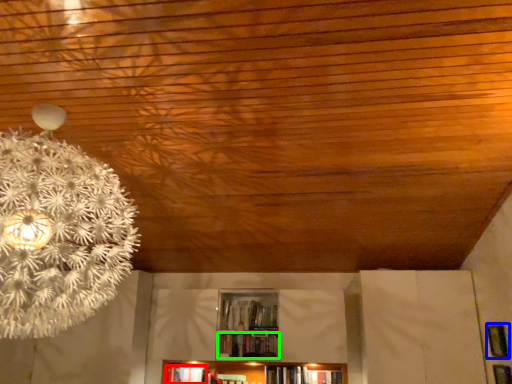
Question: Which object is positioned farthest from book (highlighted by a red box)? Select from panel (highlighted by a blue box) and book (highlighted by a green box).

Choices:
 (A) panel
 (B) book

Answer: (A)